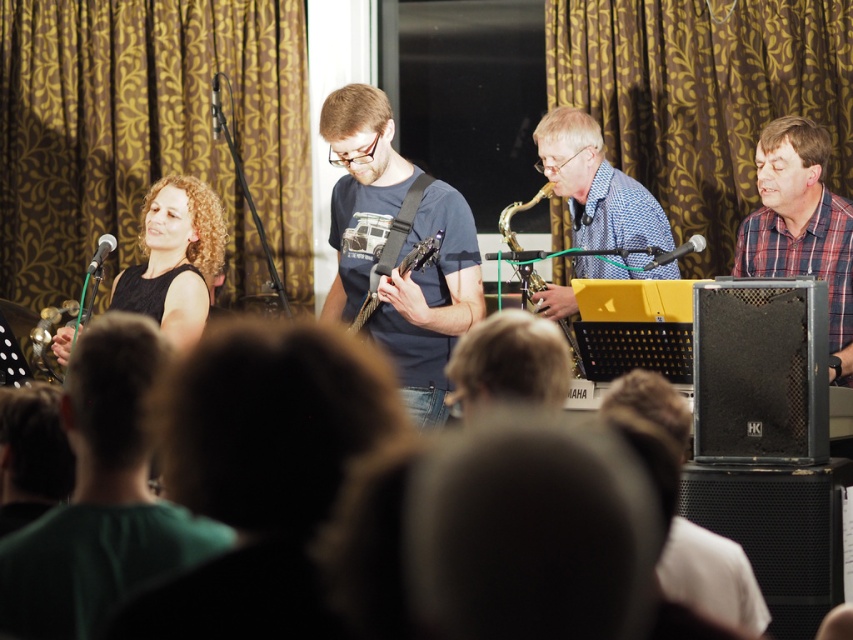
Is blue checkered shirt at center bigger than black dress at left?

Correct, blue checkered shirt at center is larger in size than black dress at left.

Does blue checkered shirt at center have a greater height compared to black dress at left?

Indeed, blue checkered shirt at center has a greater height compared to black dress at left.

Which is behind, point (573, 230) or point (157, 321)?

The point (573, 230) is behind.

What are the coordinates of `blue checkered shirt at center` in the screenshot? It's located at (596, 186).

The height and width of the screenshot is (640, 853). Identify the location of dark brown leather jacket at center. (508, 362).

Is point (512, 397) farther from camera compared to point (424, 241)?

No.

Is point (502, 385) positioned before point (421, 248)?

That is True.

Where is `dark brown leather jacket at center`? This screenshot has height=640, width=853. dark brown leather jacket at center is located at coordinates [508, 362].

Between dark brown leather jacket at center and metallic gold saxophone at center, which one is positioned lower?

dark brown leather jacket at center is lower down.

Which is in front, point (448, 397) or point (508, 209)?

Point (448, 397) is more forward.

Where is `dark brown leather jacket at center`? dark brown leather jacket at center is located at coordinates (508, 362).